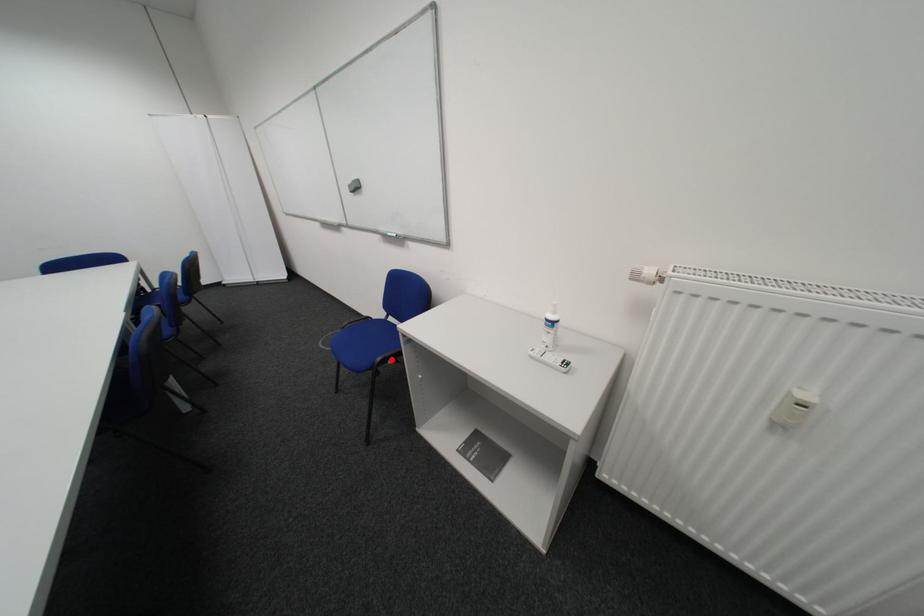
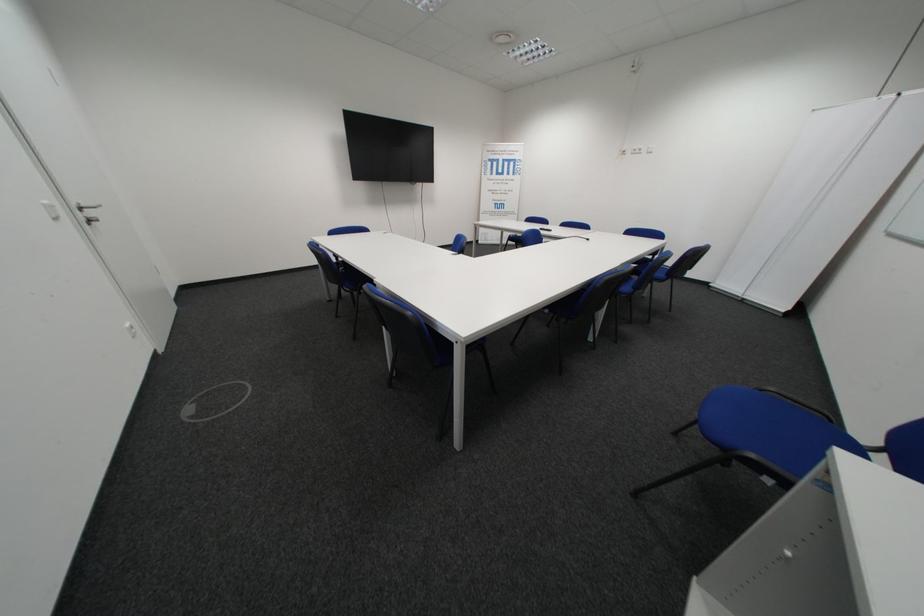
Question: I am providing you with two images of the same scene from different viewpoints. In image1, a red point is highlighted. Considering the same 3D point in image2, which of the following is correct?

Choices:
 (A) It is closer
 (B) It is farther

Answer: (A)